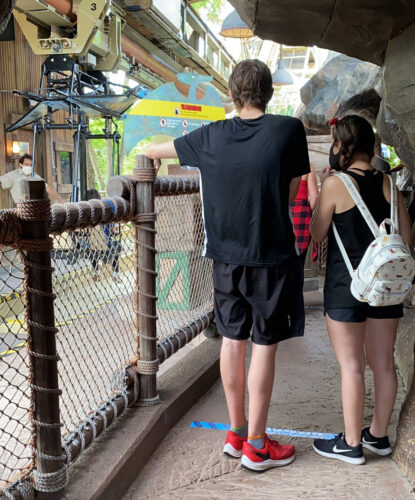
Locate an element on the screen. This screenshot has height=500, width=415. blue line on floor is located at coordinates (293, 435).